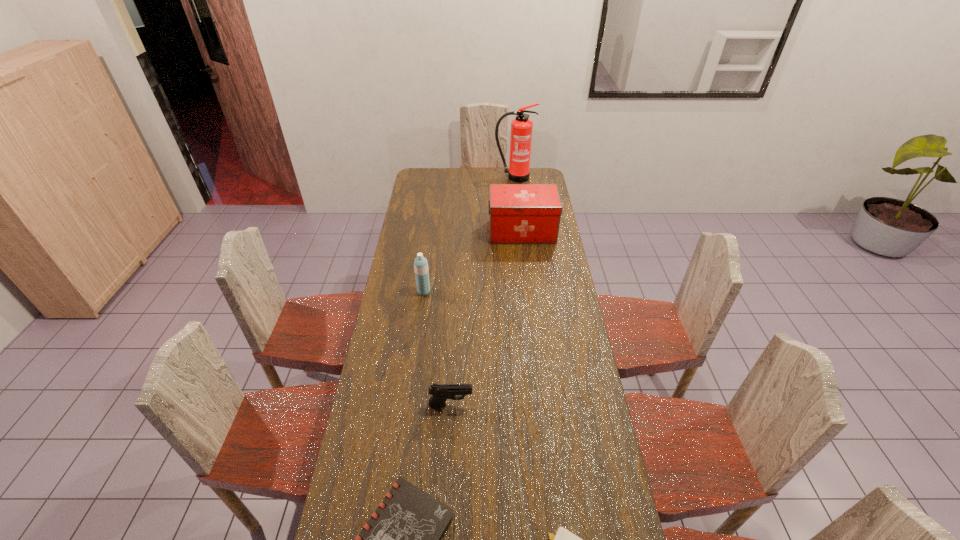
The height and width of the screenshot is (540, 960). In order to click on blank space at the far left corner of the desktop in this screenshot , I will do `click(433, 168)`.

In the image, there is a desktop. At what (x,y) coordinates should I click in order to perform the action: click on vacant space at the far right corner. Please return your answer as a coordinate pair (x, y). Image resolution: width=960 pixels, height=540 pixels. Looking at the image, I should click on (532, 183).

The height and width of the screenshot is (540, 960). Find the location of `vacant region between the third nearest object and the first-aid kit`. vacant region between the third nearest object and the first-aid kit is located at coordinates (487, 318).

Locate an element on the screen. The image size is (960, 540). free space between the tallest object and the water bottle is located at coordinates (468, 234).

I want to click on vacant area between the water bottle and the first-aid kit, so tap(473, 262).

Locate an element on the screen. Image resolution: width=960 pixels, height=540 pixels. the fifth closest object relative to the farthest object is located at coordinates (560, 539).

Identify which object is the fourth closest to the first-aid kit. Please provide its 2D coordinates. Your answer should be formatted as a tuple, i.e. [(x, y)], where the tuple contains the x and y coordinates of a point satisfying the conditions above.

[(402, 539)]

The height and width of the screenshot is (540, 960). In order to click on free space that satisfies the following two spatial constraints: 1. at the nozzle of the farthest object; 2. at the barrel of the pistol in this screenshot , I will do `click(539, 404)`.